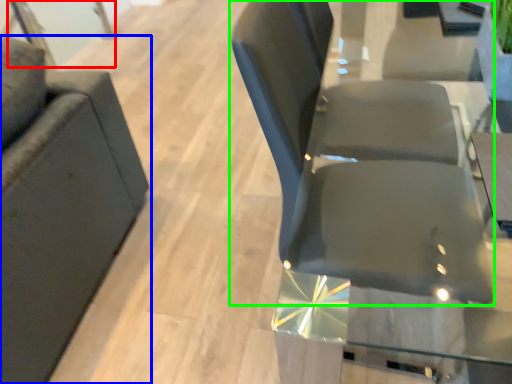
Question: Which object is positioned farthest from glass door (highlighted by a red box)? Select from chair (highlighted by a blue box) and chair (highlighted by a green box).

Choices:
 (A) chair
 (B) chair

Answer: (B)